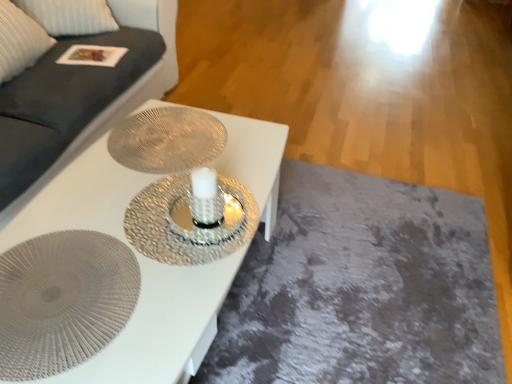
This screenshot has width=512, height=384. I want to click on vacant area that is situated to the right of white textured table at center, so click(x=331, y=308).